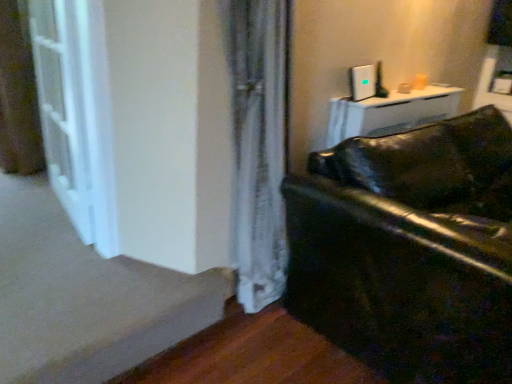
Question: Is the position of smooth beige carpet at lower left more distant than that of white glossy screen door at left?

Choices:
 (A) no
 (B) yes

Answer: (A)

Question: Are smooth beige carpet at lower left and white glossy screen door at left beside each other?

Choices:
 (A) no
 (B) yes

Answer: (A)

Question: From the image's perspective, is smooth beige carpet at lower left located above white glossy screen door at left?

Choices:
 (A) yes
 (B) no

Answer: (B)

Question: Is white glossy screen door at left a part of smooth beige carpet at lower left?

Choices:
 (A) no
 (B) yes

Answer: (A)

Question: Is smooth beige carpet at lower left far away from white glossy screen door at left?

Choices:
 (A) no
 (B) yes

Answer: (A)

Question: From the image's perspective, is smooth beige carpet at lower left located beneath white glossy screen door at left?

Choices:
 (A) yes
 (B) no

Answer: (A)

Question: Does white glossy screen door at left come behind smooth beige carpet at lower left?

Choices:
 (A) no
 (B) yes

Answer: (B)

Question: Is white glossy screen door at left oriented towards smooth beige carpet at lower left?

Choices:
 (A) no
 (B) yes

Answer: (A)

Question: From a real-world perspective, is white glossy screen door at left physically below smooth beige carpet at lower left?

Choices:
 (A) no
 (B) yes

Answer: (A)

Question: Is white glossy screen door at left shorter than smooth beige carpet at lower left?

Choices:
 (A) no
 (B) yes

Answer: (A)

Question: Is white glossy screen door at left positioned in front of smooth beige carpet at lower left?

Choices:
 (A) no
 (B) yes

Answer: (A)

Question: From a real-world perspective, does white glossy screen door at left stand above smooth beige carpet at lower left?

Choices:
 (A) no
 (B) yes

Answer: (B)

Question: Is glossy black leather couch at lower right taller than smooth beige carpet at lower left?

Choices:
 (A) no
 (B) yes

Answer: (B)